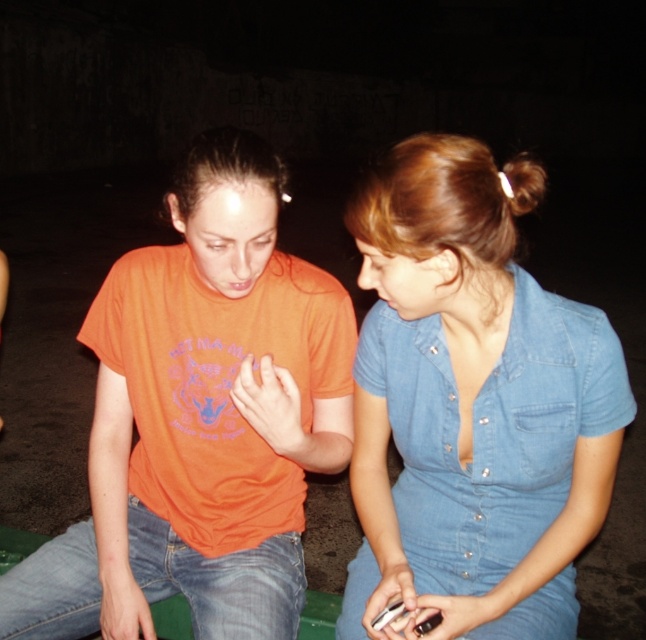
Which is above, orange cotton shirt at center or denim dress at center?

denim dress at center is above.

Locate an element on the screen. The width and height of the screenshot is (646, 640). orange cotton shirt at center is located at coordinates (202, 419).

You are a GUI agent. You are given a task and a screenshot of the screen. Output one action in this format:
    pyautogui.click(x=<x>, y=<y>)
    Task: Click on the orange cotton shirt at center
    Image resolution: width=646 pixels, height=640 pixels.
    Given the screenshot: What is the action you would take?
    202,419

You are a GUI agent. You are given a task and a screenshot of the screen. Output one action in this format:
    pyautogui.click(x=<x>, y=<y>)
    Task: Click on the orange cotton shirt at center
    
    Given the screenshot: What is the action you would take?
    pyautogui.click(x=202, y=419)